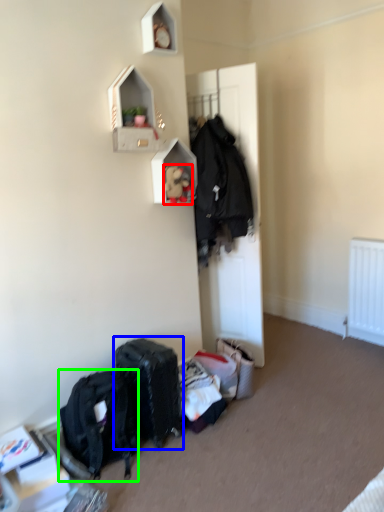
Question: Based on their relative distances, which object is farther from toy (highlighted by a red box)? Choose from luggage and bags (highlighted by a blue box) and backpack (highlighted by a green box).

Choices:
 (A) luggage and bags
 (B) backpack

Answer: (B)